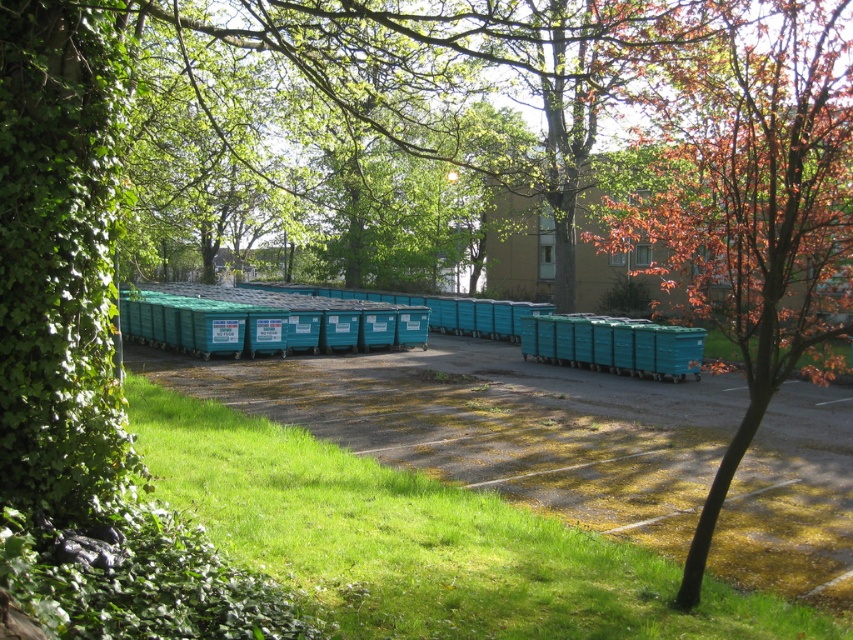
Question: Which point is closer to the camera taking this photo?

Choices:
 (A) (746, 44)
 (B) (320, 595)

Answer: (B)

Question: Can you confirm if green grass at lower left is wider than reddish-brown bark tree at right?

Choices:
 (A) no
 (B) yes

Answer: (A)

Question: Can you confirm if green grass at lower left is positioned to the left of reddish-brown bark tree at right?

Choices:
 (A) yes
 (B) no

Answer: (A)

Question: Does green grass at lower left have a greater width compared to reddish-brown bark tree at right?

Choices:
 (A) no
 (B) yes

Answer: (A)

Question: Which object is farther from the camera taking this photo?

Choices:
 (A) reddish-brown bark tree at right
 (B) green grass at lower left

Answer: (A)

Question: Which object is farther from the camera taking this photo?

Choices:
 (A) green grass at lower left
 (B) reddish-brown bark tree at right

Answer: (B)